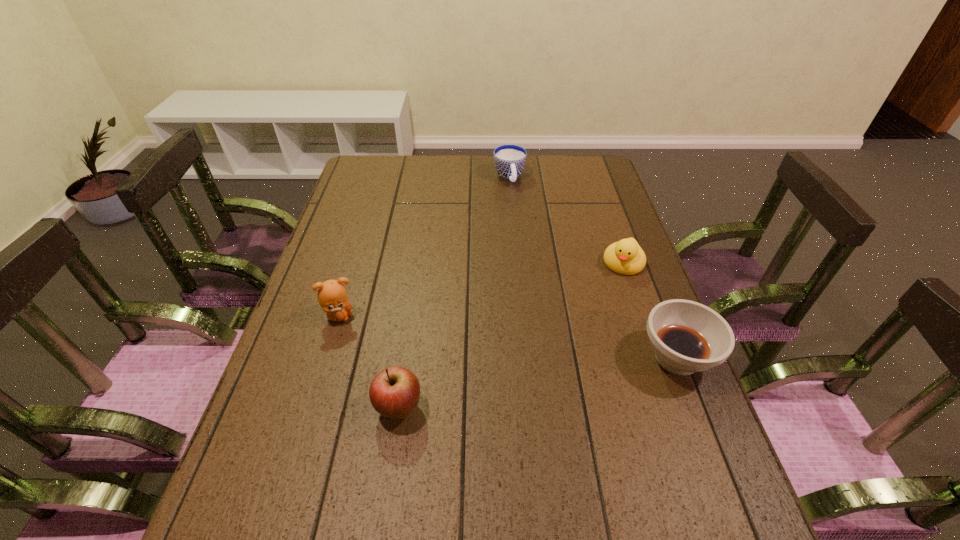
I want to click on free spot on the desktop that is between the fourth object from right to left and the soup bowl and is positioned on the face of the leftmost object, so click(560, 379).

Identify the location of free spot on the desktop that is between the fourth object from right to left and the soup bowl and is positioned on the face of the duckling. (572, 377).

You are a GUI agent. You are given a task and a screenshot of the screen. Output one action in this format:
    pyautogui.click(x=<x>, y=<y>)
    Task: Click on the free space on the desktop that is between the second object from left to right and the soup bowl and is positioned on the side of the third object from left to right with the handle
    This screenshot has height=540, width=960.
    Given the screenshot: What is the action you would take?
    pyautogui.click(x=583, y=375)